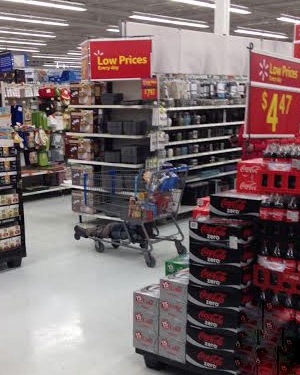
Find the location of a particular element. This screenshot has width=300, height=375. tile is located at coordinates (27, 262).